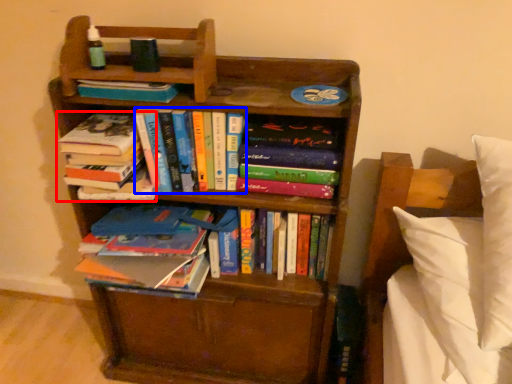
Question: Which object appears closest to the camera in this image, book (highlighted by a red box) or book (highlighted by a blue box)?

Choices:
 (A) book
 (B) book

Answer: (B)